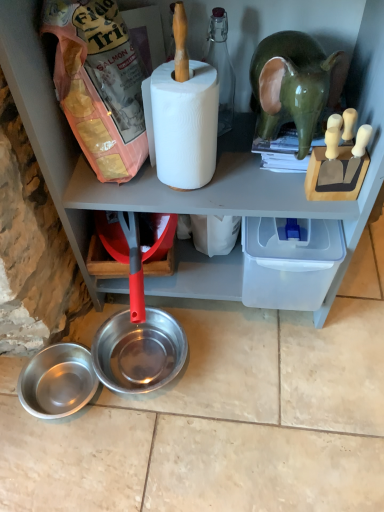
Question: Is matte pink plastic bag of dog food at upper left bigger or smaller than green glossy elephant at upper right?

Choices:
 (A) big
 (B) small

Answer: (A)

Question: Considering the positions of matte pink plastic bag of dog food at upper left and green glossy elephant at upper right in the image, is matte pink plastic bag of dog food at upper left taller or shorter than green glossy elephant at upper right?

Choices:
 (A) tall
 (B) short

Answer: (A)

Question: Estimate the real-world distances between objects in this image. Which object is farther from the brushed metal bowl at lower left, which appears as the 2th bowl when viewed from the right?

Choices:
 (A) white matte paper towel at center
 (B) green glossy elephant at upper right
 (C) shiny metallic bowl at lower center, the 1th bowl when ordered from right to left
 (D) matte pink plastic bag of dog food at upper left

Answer: (B)

Question: Estimate the real-world distances between objects in this image. Which object is farther from the shiny metallic bowl at lower center, which is counted as the 2th bowl, starting from the left?

Choices:
 (A) green glossy elephant at upper right
 (B) matte pink plastic bag of dog food at upper left
 (C) white matte paper towel at center
 (D) brushed metal bowl at lower left, the 1th bowl positioned from the left

Answer: (A)